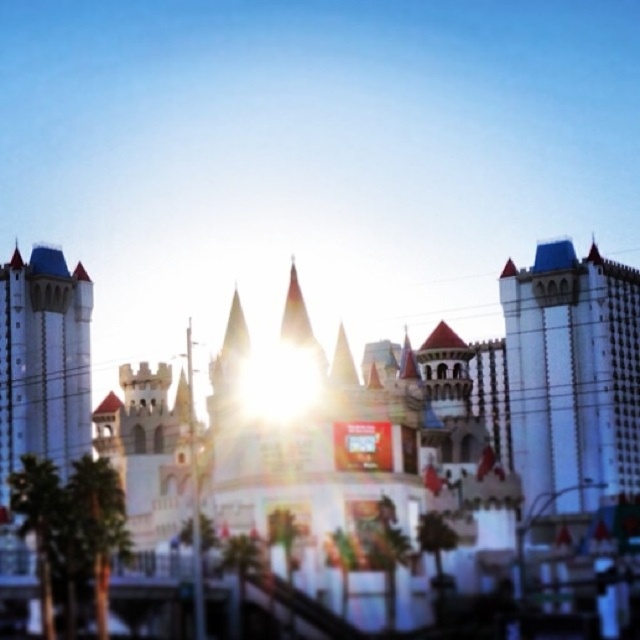
Question: In this image, where is white stone amusement park at center located relative to white textured building at center?

Choices:
 (A) left
 (B) right

Answer: (A)

Question: Does white stone amusement park at center have a greater width compared to white textured building at center?

Choices:
 (A) no
 (B) yes

Answer: (B)

Question: Which object is closer to the camera taking this photo?

Choices:
 (A) white stone amusement park at center
 (B) white stone castle at left
 (C) white textured building at center

Answer: (A)

Question: Estimate the real-world distances between objects in this image. Which object is closer to the white stone castle at left?

Choices:
 (A) white textured building at center
 (B) white stone amusement park at center

Answer: (B)

Question: Does white textured building at center have a greater width compared to white stone castle at left?

Choices:
 (A) no
 (B) yes

Answer: (B)

Question: Which object is farther from the camera taking this photo?

Choices:
 (A) white stone castle at left
 (B) white textured building at center
 (C) white stone amusement park at center

Answer: (A)